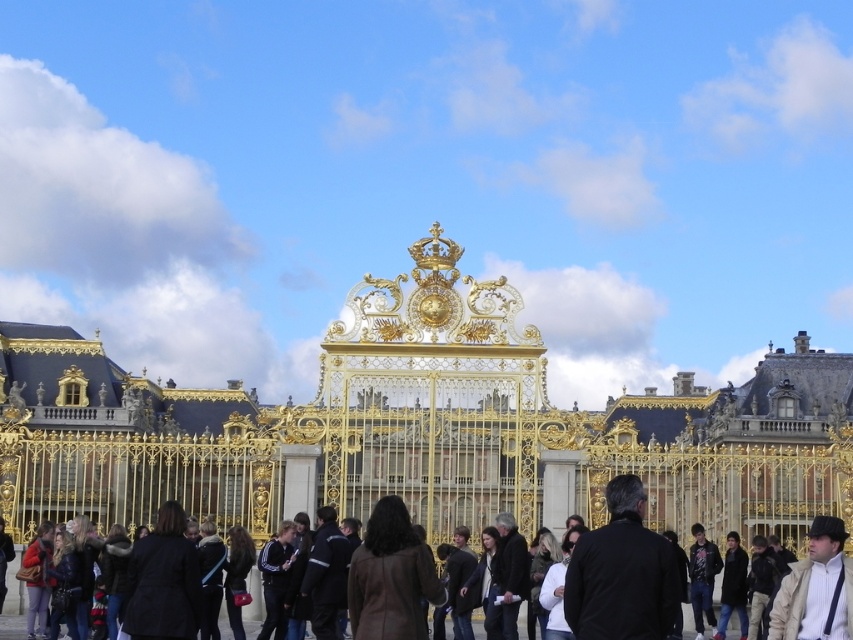
Question: Which object is closer to the camera taking this photo?

Choices:
 (A) gold metallic gate at center
 (B) dark brown leather jacket at lower left

Answer: (B)

Question: Is matte red coat at lower left smaller than shiny brown coat at center?

Choices:
 (A) no
 (B) yes

Answer: (A)

Question: Can you confirm if brown leather coat at center is positioned to the left of white cotton jacket at center?

Choices:
 (A) no
 (B) yes

Answer: (B)

Question: Can you confirm if gold metallic gate at center is positioned below black leather jacket at center?

Choices:
 (A) no
 (B) yes

Answer: (A)

Question: Which point is farther to the camera?

Choices:
 (A) brown leather coat at center
 (B) gold metallic gate at center
 (C) dark gray hoodie at center

Answer: (B)

Question: Which object appears farthest from the camera in this image?

Choices:
 (A) matte red coat at lower left
 (B) dark gray hoodie at center
 (C) white matte jacket at center

Answer: (B)